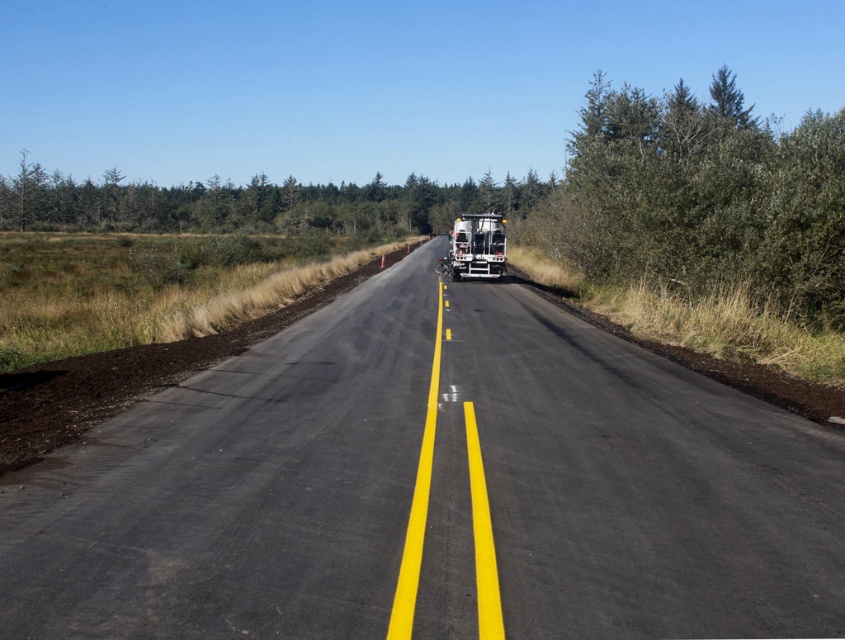
Question: Does green leafy shrub at right appear on the right side of metallic silver trailer truck at center?

Choices:
 (A) yes
 (B) no

Answer: (A)

Question: Is black asphalt road at center smaller than metallic silver trailer truck at center?

Choices:
 (A) yes
 (B) no

Answer: (A)

Question: Can you confirm if green leafy shrub at right is thinner than green leafy trees at upper center?

Choices:
 (A) no
 (B) yes

Answer: (B)

Question: Among these objects, which one is nearest to the camera?

Choices:
 (A) black asphalt road at center
 (B) green leafy shrub at right

Answer: (A)

Question: Which point appears farthest from the camera in this image?

Choices:
 (A) (416, 221)
 (B) (497, 227)

Answer: (A)

Question: Considering the real-world distances, which object is closest to the black asphalt road at center?

Choices:
 (A) green leafy shrub at right
 (B) green leafy trees at upper center
 (C) metallic silver trailer truck at center

Answer: (C)